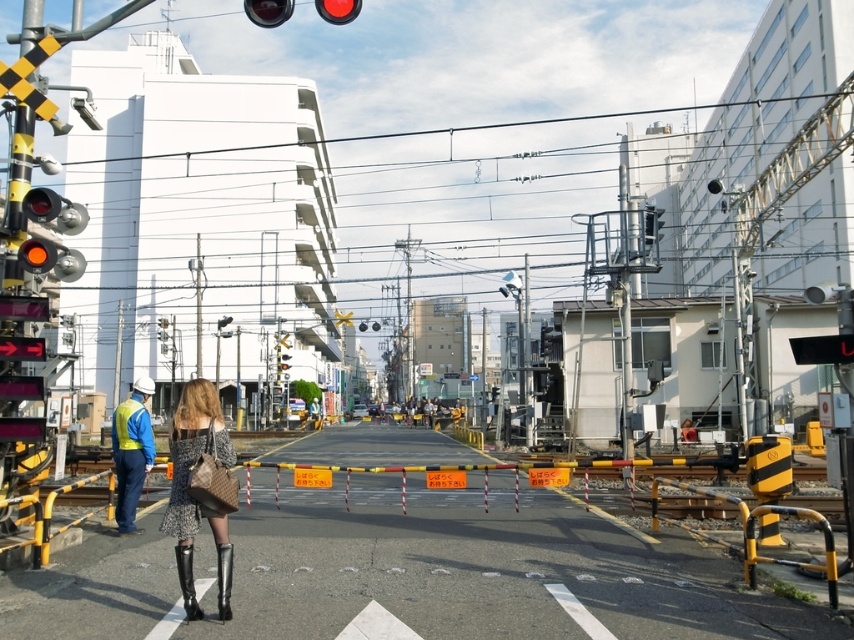
In the scene shown: You are a driver approaching the railway crossing and see the matte black traffic light at upper center and the matte glass traffic light at upper center. Which traffic light is on your right side when facing the railway crossing?

The matte black traffic light at upper center is positioned on the right side of matte glass traffic light at upper center, so when facing the railway crossing, the matte black traffic light at upper center would be on your right side.

You are a delivery person standing at the railway crossing. You need to deliver a package to a location 10 meters ahead on the road. The matte black traffic light at upper center is in your path. Can you safely pass under it without hitting your head?

The matte black traffic light at upper center is 8.09 meters away from the viewer. Since the delivery person needs to go 10 meters ahead, the traffic light is within that distance. However, the height of the traffic light isn not mentioned, so it is impossible to determine if it will hit the head. More information about the height is needed.